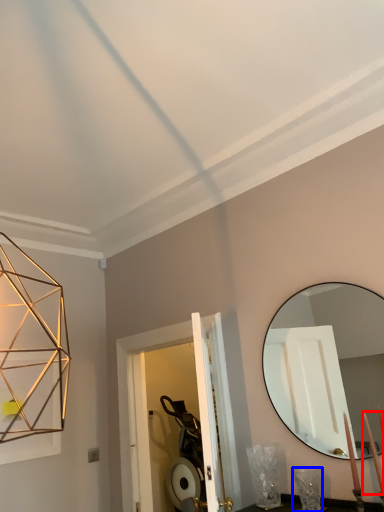
Question: Among these objects, which one is farthest to the camera, candle (highlighted by a red box) or table lamp (highlighted by a blue box)?

Choices:
 (A) candle
 (B) table lamp

Answer: (B)